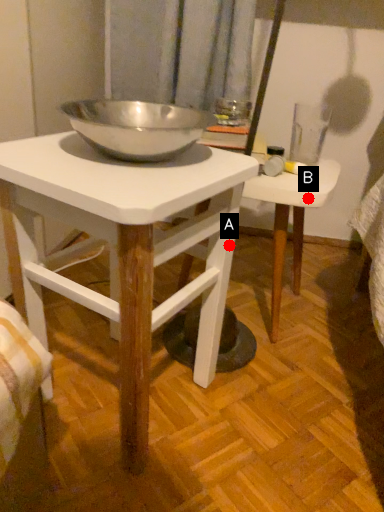
Question: Two points are circled on the image, labeled by A and B beside each circle. Which point is closer to the camera?

Choices:
 (A) A is closer
 (B) B is closer

Answer: (A)